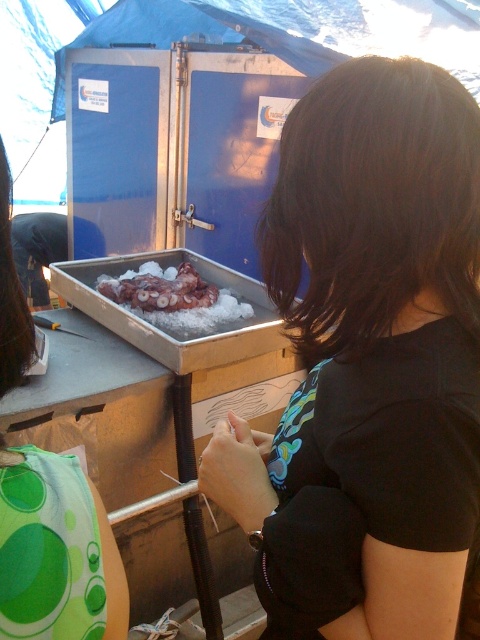
Does black matte shirt at center lie behind reddish-brown gelatinous octopus at center?

No, black matte shirt at center is closer to the viewer.

Consider the image. Can you confirm if black matte shirt at center is smaller than reddish-brown gelatinous octopus at center?

Actually, black matte shirt at center might be larger than reddish-brown gelatinous octopus at center.

Find the location of a particular element. The height and width of the screenshot is (640, 480). black matte shirt at center is located at coordinates (368, 362).

What are the coordinates of `black matte shirt at center` in the screenshot? It's located at pos(368,362).